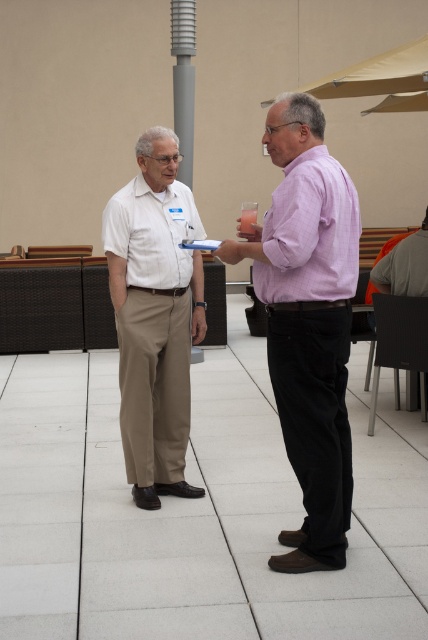
You are a photographer setting up for an outdoor event. You need to position a large camera between the purple cotton shirt at right and the light beige cotton pants at left. Based on their positions, will the camera fit between them if it requires 1 meter of space?

The purple cotton shirt at right might be wider than light beige cotton pants at left, but without exact measurements, it is uncertain if the 1 meter space requirement is met. Check the actual distance between them.

You are organizing a clothing display and need to arrange the purple cotton shirt at right and the purple cotton shirt at center based on their sizes. Which shirt should you place first if you want to arrange them from largest to smallest?

The purple cotton shirt at right has a greater width than the purple cotton shirt at center, so you should place the purple cotton shirt at right first when arranging from largest to smallest.